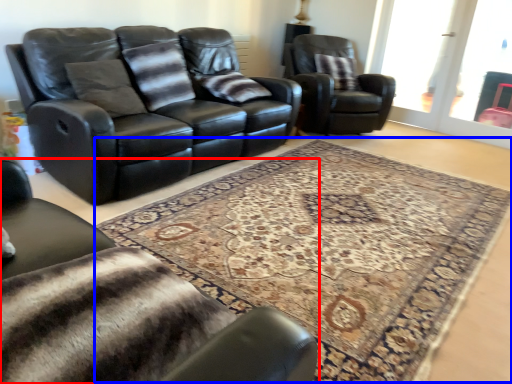
Question: Which of the following is the farthest to the observer, chair (highlighted by a red box) or mat (highlighted by a blue box)?

Choices:
 (A) chair
 (B) mat

Answer: (B)